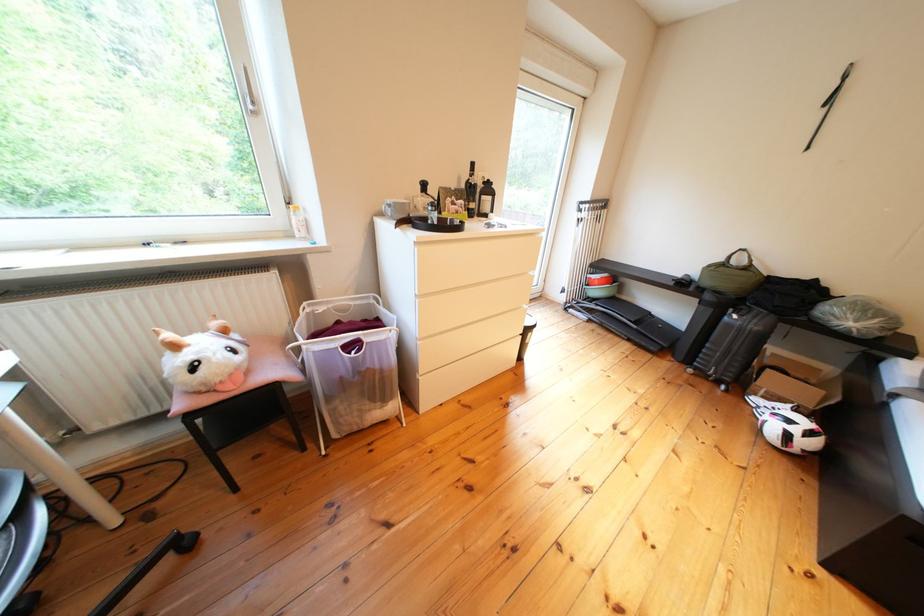
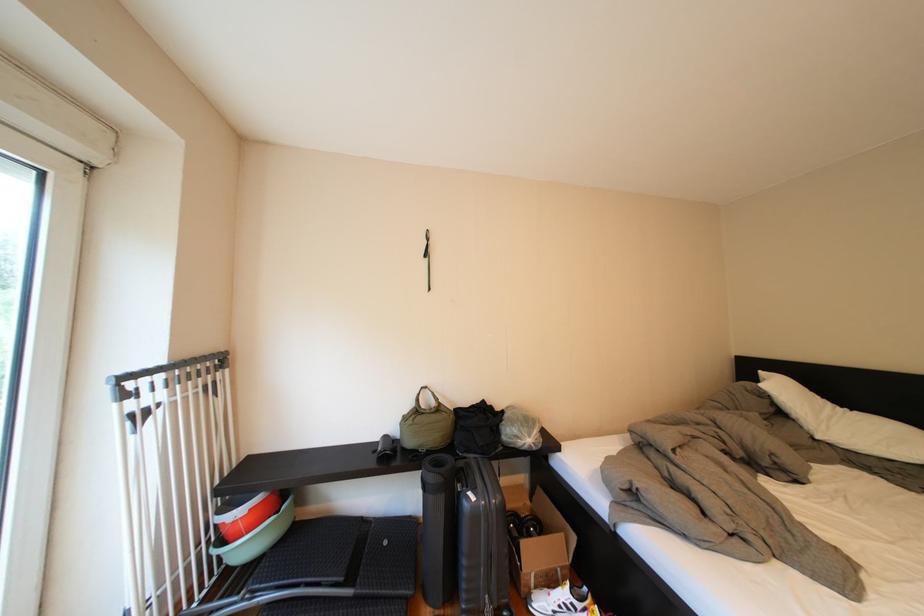
The point at (771, 405) is marked in the first image. Where is the corresponding point in the second image?

(554, 609)